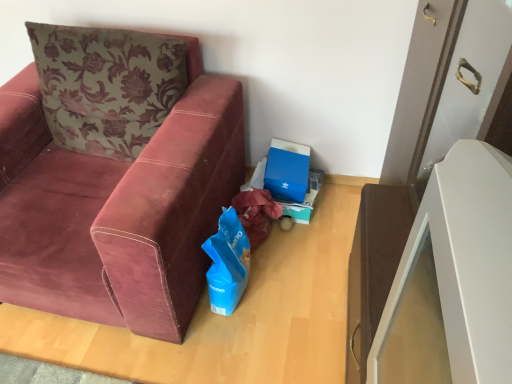
Describe the element at coordinates (117, 209) in the screenshot. I see `velvet maroon couch at left` at that location.

At what (x,y) coordinates should I click in order to perform the action: click on blue cardboard box at center. Please return your answer as a coordinate pair (x, y). The width and height of the screenshot is (512, 384). Looking at the image, I should click on (287, 171).

Where is `blue matte gift bag at lower center`? The width and height of the screenshot is (512, 384). blue matte gift bag at lower center is located at coordinates (227, 263).

I want to click on velvet maroon couch at left, so click(117, 209).

Looking at this image, from a real-world perspective, which object rests below the other?

blue cardboard box at center.

Considering the sizes of objects blue cardboard box at center and velvet maroon couch at left in the image provided, who is smaller, blue cardboard box at center or velvet maroon couch at left?

Smaller between the two is blue cardboard box at center.

Where is `studio couch above the blue cardboard box at center (from a real-world perspective)`? studio couch above the blue cardboard box at center (from a real-world perspective) is located at coordinates (117, 209).

Could you tell me if blue matte gift bag at lower center is facing blue cardboard box at center?

No, blue matte gift bag at lower center is not facing towards blue cardboard box at center.

Does blue matte gift bag at lower center appear on the right side of blue cardboard box at center?

Incorrect, blue matte gift bag at lower center is not on the right side of blue cardboard box at center.

Considering the relative positions of blue matte gift bag at lower center and blue cardboard box at center in the image provided, is blue matte gift bag at lower center in front of blue cardboard box at center?

Yes, blue matte gift bag at lower center is in front of blue cardboard box at center.

Is blue matte gift bag at lower center situated inside blue cardboard box at center or outside?

blue matte gift bag at lower center cannot be found inside blue cardboard box at center.

Is blue matte gift bag at lower center oriented towards velvet maroon couch at left?

No, blue matte gift bag at lower center does not turn towards velvet maroon couch at left.

Image resolution: width=512 pixels, height=384 pixels. I want to click on studio couch in front of the blue matte gift bag at lower center, so click(117, 209).

Considering the sizes of objects blue matte gift bag at lower center and velvet maroon couch at left in the image provided, who is wider, blue matte gift bag at lower center or velvet maroon couch at left?

Wider between the two is velvet maroon couch at left.

Between blue cardboard box at center and blue matte gift bag at lower center, which one is positioned behind?

blue cardboard box at center is further from the camera.

Is point (281, 192) positioned behind point (243, 232)?

Yes, point (281, 192) is behind point (243, 232).

Are blue cardboard box at center and blue matte gift bag at lower center located far from each other?

No, blue cardboard box at center is not far from blue matte gift bag at lower center.

Based on the photo, is blue matte gift bag at lower center at the back of blue cardboard box at center?

No, blue matte gift bag at lower center is not at the back of blue cardboard box at center.

Is point (226, 204) closer to camera compared to point (293, 169)?

That is True.

Which of these two, velvet maroon couch at left or blue cardboard box at center, is bigger?

velvet maroon couch at left is bigger.

From a real-world perspective, is velvet maroon couch at left over blue cardboard box at center?

Yes, from a real-world perspective, velvet maroon couch at left is on top of blue cardboard box at center.

From the image's perspective, is velvet maroon couch at left on blue matte gift bag at lower center?

Yes, from the image's perspective, velvet maroon couch at left is over blue matte gift bag at lower center.

Are velvet maroon couch at left and blue matte gift bag at lower center beside each other?

velvet maroon couch at left is not next to blue matte gift bag at lower center, and they're not touching.

Consider the image. Is velvet maroon couch at left positioned with its back to blue matte gift bag at lower center?

No, velvet maroon couch at left is not facing away from blue matte gift bag at lower center.

Which is more distant, [165,190] or [221,227]?

The point [221,227] is farther from the camera.

Locate an element on the screen. Image resolution: width=512 pixels, height=384 pixels. studio couch on the left of blue cardboard box at center is located at coordinates (117, 209).

In the image, there is a blue matte gift bag at lower center. Identify the location of cardboard box above it (from the image's perspective). This screenshot has width=512, height=384. (287, 171).

When comparing their distances from velvet maroon couch at left, does blue matte gift bag at lower center or blue cardboard box at center seem further?

Based on the image, blue cardboard box at center appears to be further to velvet maroon couch at left.

Based on their spatial positions, is blue cardboard box at center or velvet maroon couch at left further from blue matte gift bag at lower center?

blue cardboard box at center is further to blue matte gift bag at lower center.

Estimate the real-world distances between objects in this image. Which object is closer to blue cardboard box at center, blue matte gift bag at lower center or velvet maroon couch at left?

blue matte gift bag at lower center.

From the image, which object appears to be nearer to blue cardboard box at center, velvet maroon couch at left or blue matte gift bag at lower center?

blue matte gift bag at lower center.

Based on their spatial positions, is velvet maroon couch at left or blue cardboard box at center closer to blue matte gift bag at lower center?

Among the two, velvet maroon couch at left is located nearer to blue matte gift bag at lower center.

When comparing their distances from velvet maroon couch at left, does blue cardboard box at center or blue matte gift bag at lower center seem closer?

blue matte gift bag at lower center.

At what (x,y) coordinates should I click in order to perform the action: click on gift bag located between velvet maroon couch at left and blue cardboard box at center in the depth direction. Please return your answer as a coordinate pair (x, y). Looking at the image, I should click on (227, 263).